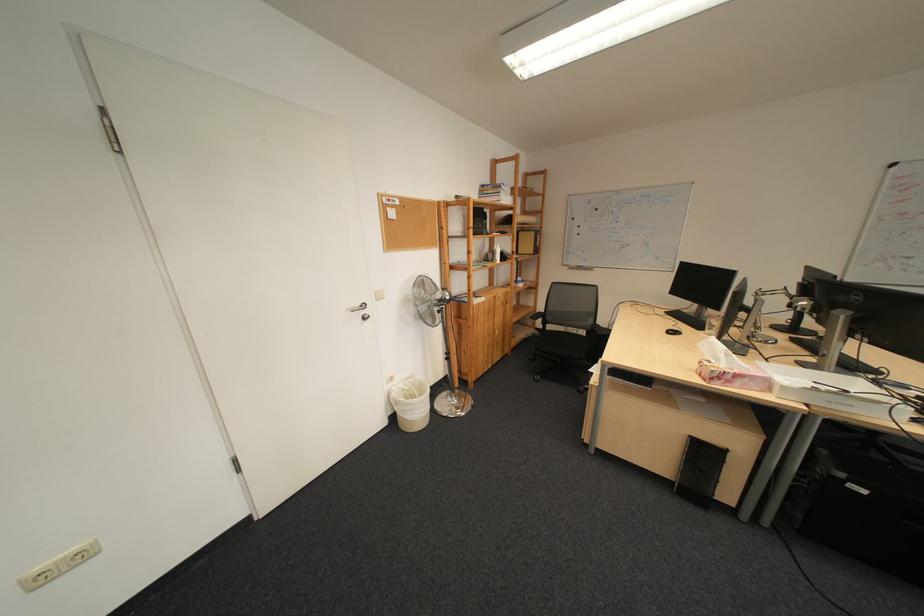
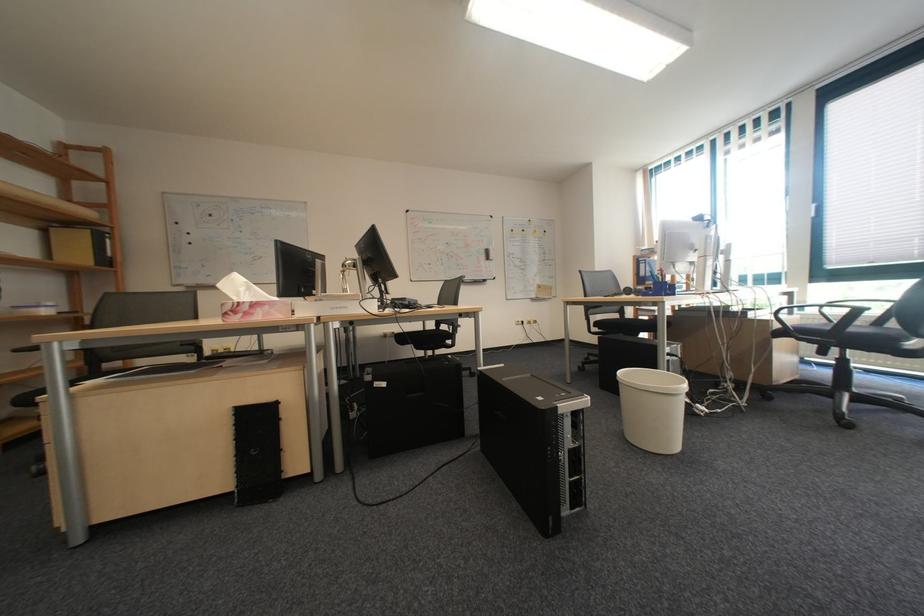
The point at (643, 246) is marked in the first image. Where is the corresponding point in the second image?

(275, 257)